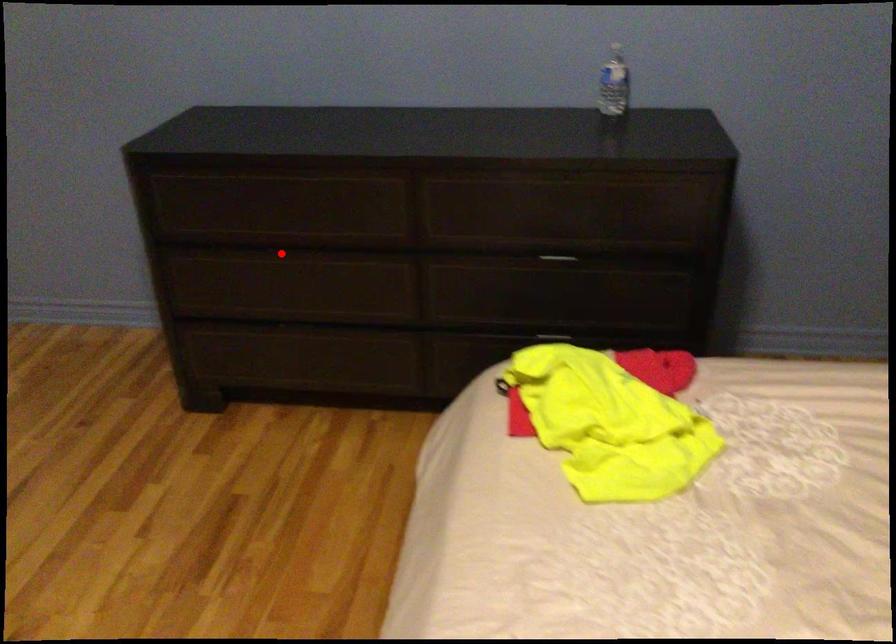
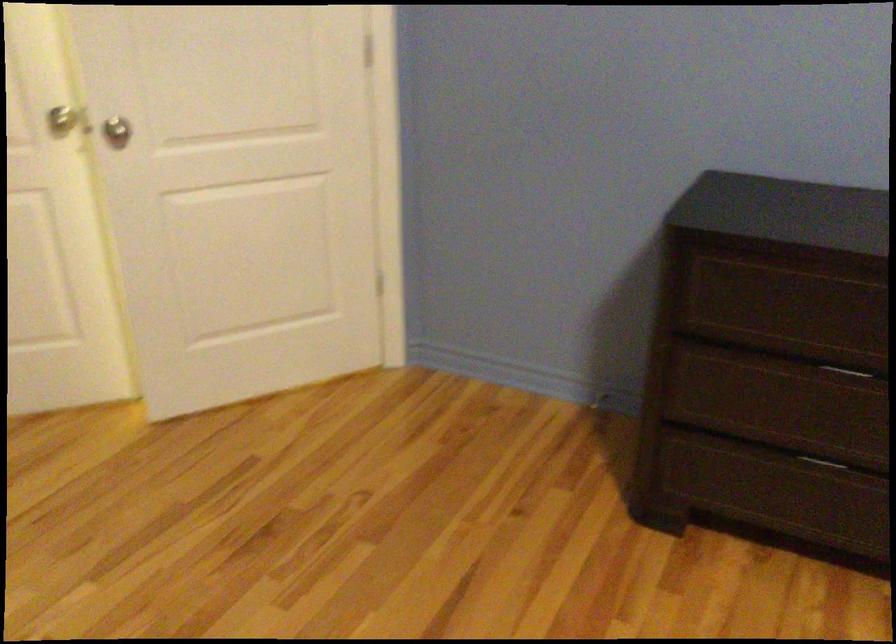
Locate, in the second image, the point that corresponds to the highlighted location in the first image.

(850, 371)